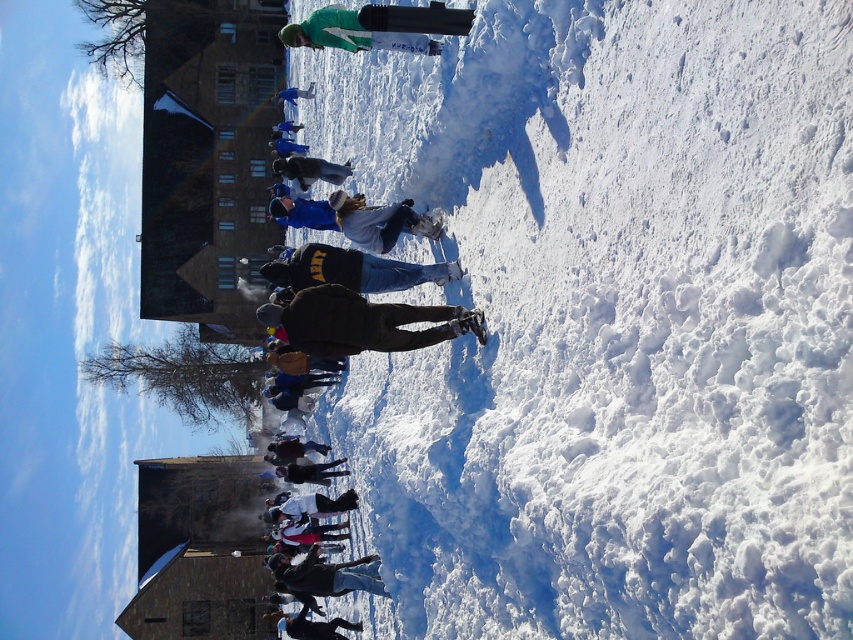
You are standing in the snowy scene and notice two jackets at the center. Which jacket is closer to the ground, the dark brown jacket at center or the blue fabric jacket at center?

The dark brown jacket at center is closer to the ground because it is located below the blue fabric jacket at center.

You are a photographer trying to capture both the blue fabric jacket at center and the matte blue jacket at center in a single frame. Which jacket should you focus on first to ensure both are in the shot?

The blue fabric jacket at center is positioned under the matte blue jacket at center, so focusing on the matte blue jacket at center first will allow you to frame both jackets in the shot.

You are trying to distinguish between two people wearing blue jackets in the snowy scene. The person wearing the blue fabric jacket at center and the other wearing the matte blue jacket at center. Which of their jackets is shorter?

The blue fabric jacket at center is shorter than the matte blue jacket at center.